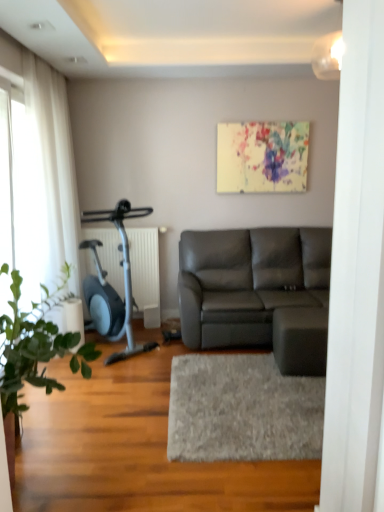
Question: Would you say green leafy plant at left contains matte gray leather couch at center?

Choices:
 (A) yes
 (B) no

Answer: (B)

Question: Is green leafy plant at left turned away from matte gray leather couch at center?

Choices:
 (A) no
 (B) yes

Answer: (A)

Question: From a real-world perspective, is green leafy plant at left on matte gray leather couch at center?

Choices:
 (A) yes
 (B) no

Answer: (A)

Question: Is green leafy plant at left further to camera compared to matte gray leather couch at center?

Choices:
 (A) no
 (B) yes

Answer: (A)

Question: Does green leafy plant at left have a lesser width compared to matte gray leather couch at center?

Choices:
 (A) no
 (B) yes

Answer: (B)

Question: Is green leafy plant at left next to matte gray leather couch at center and touching it?

Choices:
 (A) no
 (B) yes

Answer: (A)

Question: From a real-world perspective, is transparent glass door at left physically above white sheer curtain at left?

Choices:
 (A) no
 (B) yes

Answer: (B)

Question: Can you confirm if transparent glass door at left is smaller than white sheer curtain at left?

Choices:
 (A) yes
 (B) no

Answer: (A)

Question: From the image's perspective, does transparent glass door at left appear higher than white sheer curtain at left?

Choices:
 (A) no
 (B) yes

Answer: (A)

Question: Does transparent glass door at left have a greater width compared to white sheer curtain at left?

Choices:
 (A) yes
 (B) no

Answer: (B)

Question: Does transparent glass door at left touch white sheer curtain at left?

Choices:
 (A) no
 (B) yes

Answer: (A)

Question: Considering the relative sizes of transparent glass door at left and white sheer curtain at left in the image provided, is transparent glass door at left thinner than white sheer curtain at left?

Choices:
 (A) yes
 (B) no

Answer: (A)

Question: Is white sheer curtain at left bigger than matte gray leather couch at center?

Choices:
 (A) yes
 (B) no

Answer: (B)